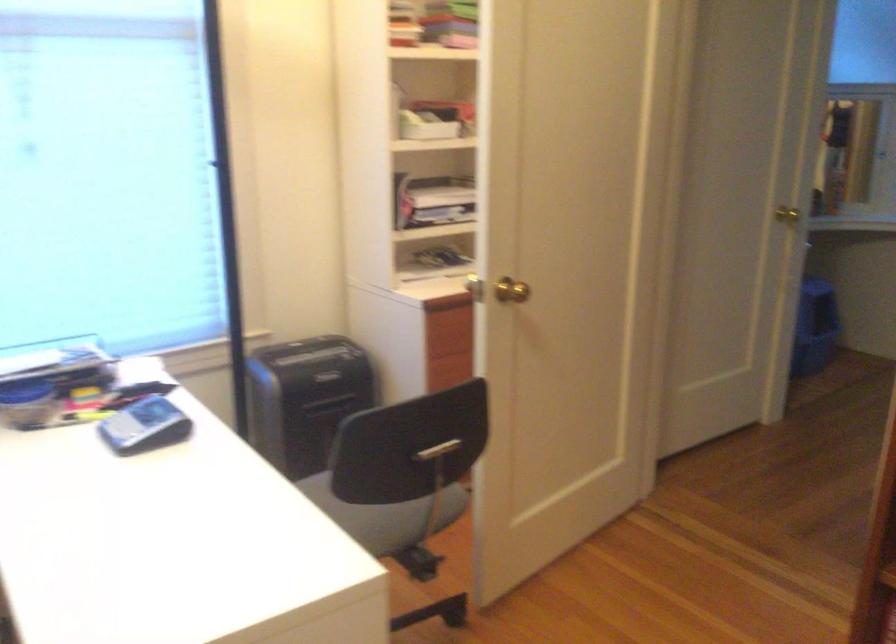
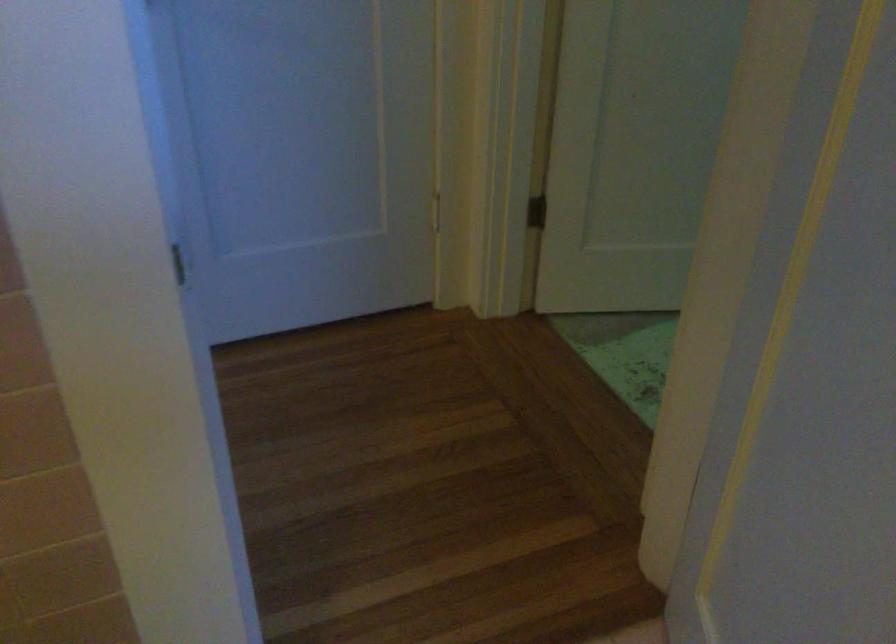
Which direction would the cameraman need to move to produce the second image?

The movement direction of the cameraman is right, forward.